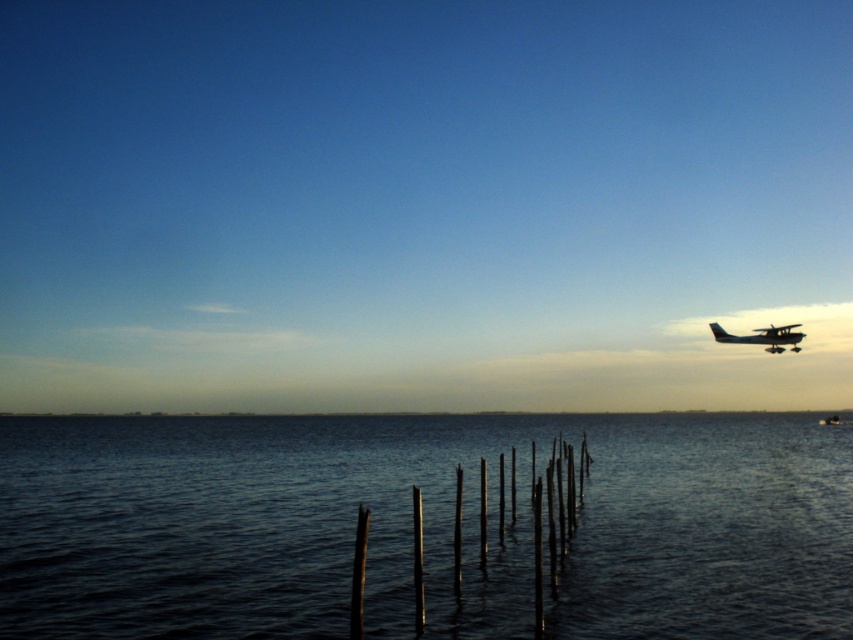
You are standing on the shore looking at the scene. Which object is higher in the image, the dark blue water at center or the metallic silver boat at right?

The dark blue water at center is located above the metallic silver boat at right, so the dark blue water at center is higher in the image.

You are standing on a boat in the middle of the dark blue water at center and want to reach the metallic silver airplane at upper right. Given that your boat can travel at 5 feet per second, how long will it take you to reach the airplane?

The distance between the dark blue water at center and the metallic silver airplane at upper right is 148.74 feet. At a speed of 5 feet per second, it would take approximately 29.75 seconds to reach the airplane.